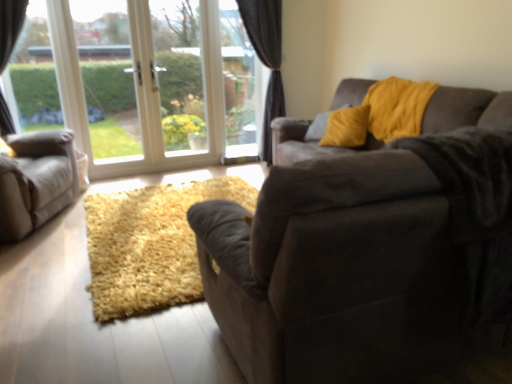
This screenshot has width=512, height=384. Find the location of `yellow fabric pillow at upper center`. yellow fabric pillow at upper center is located at coordinates (317, 127).

Where is `dark gray velvet curtain at center`? The height and width of the screenshot is (384, 512). dark gray velvet curtain at center is located at coordinates coord(266,58).

Where is `shaggy yellow rug at center`? The image size is (512, 384). shaggy yellow rug at center is located at coordinates (150, 245).

Image resolution: width=512 pixels, height=384 pixels. I want to click on yellow fabric pillow at upper center, so click(317, 127).

From a real-world perspective, is yellow fabric pillow at upper center positioned under white glass window at upper left based on gravity?

Indeed, from a real-world perspective, yellow fabric pillow at upper center is positioned beneath white glass window at upper left.

Is point (319, 133) in front of point (11, 102)?

No, it is not.

Can you confirm if yellow fabric pillow at upper center is positioned to the right of white glass window at upper left?

Correct, you'll find yellow fabric pillow at upper center to the right of white glass window at upper left.

Considering the sizes of objects yellow fabric pillow at upper center and white glass window at upper left in the image provided, who is bigger, yellow fabric pillow at upper center or white glass window at upper left?

white glass window at upper left is bigger.

Which is in front, dark gray velvet curtain at center or transparent glass door at upper left, positioned as the 1th window screen in left-to-right order?

Positioned in front is transparent glass door at upper left, positioned as the 1th window screen in left-to-right order.

The image size is (512, 384). In order to click on window screen that is the 2nd object above the dark gray velvet curtain at center (from a real-world perspective) in this screenshot , I will do `click(109, 85)`.

Is point (279, 86) more distant than point (90, 108)?

Yes, point (279, 86) is behind point (90, 108).

In terms of size, does dark gray velvet curtain at center appear bigger or smaller than transparent glass door at upper left, the 3th window screen from the right?

Considering their sizes, dark gray velvet curtain at center takes up more space than transparent glass door at upper left, the 3th window screen from the right.

From the image's perspective, which object appears higher, suede couch at center, which is the 1th studio couch in right-to-left order, or dark gray velvet curtain at center?

dark gray velvet curtain at center is shown above in the image.

The image size is (512, 384). Find the location of `curtain that appears behind the suede couch at center, the second studio couch when ordered from left to right`. curtain that appears behind the suede couch at center, the second studio couch when ordered from left to right is located at coordinates (266, 58).

Can you confirm if suede couch at center, which is the 1th studio couch in right-to-left order, is smaller than dark gray velvet curtain at center?

Incorrect, suede couch at center, which is the 1th studio couch in right-to-left order, is not smaller in size than dark gray velvet curtain at center.

Are suede couch at center, the second studio couch when ordered from left to right, and dark gray velvet curtain at center making contact?

suede couch at center, the second studio couch when ordered from left to right, and dark gray velvet curtain at center are not in contact.

Choose the correct answer: Is shaggy yellow rug at center inside dark gray velvet curtain at center or outside it?

shaggy yellow rug at center exists outside the volume of dark gray velvet curtain at center.

From a real-world perspective, is shaggy yellow rug at center located beneath dark gray velvet curtain at center?

Yes, from a real-world perspective, shaggy yellow rug at center is beneath dark gray velvet curtain at center.

Is point (136, 273) positioned in front of point (271, 141)?

Yes.

Considering the positions of point (16, 196) and point (200, 79), is point (16, 196) closer or farther from the camera than point (200, 79)?

Point (16, 196) appears to be closer to the viewer than point (200, 79).

Considering the relative sizes of matte gray armchair at left, positioned as the 1th studio couch in left-to-right order, and white glass door at center, acting as the second window screen starting from the left, in the image provided, is matte gray armchair at left, positioned as the 1th studio couch in left-to-right order, wider than white glass door at center, acting as the second window screen starting from the left,?

Yes.

From a real-world perspective, which object stands above the other?

white glass door at center, the 2th window screen from the right, is physically above.

Consider the image. Is white glass door at center, acting as the second window screen starting from the left, completely or partially inside matte gray armchair at left, arranged as the 2th studio couch when viewed from the right?

That's incorrect, white glass door at center, acting as the second window screen starting from the left, is not inside matte gray armchair at left, arranged as the 2th studio couch when viewed from the right.

Considering the points (89, 106) and (5, 199), which point is behind, point (89, 106) or point (5, 199)?

Point (89, 106)

Is transparent glass door at upper left, positioned as the 1th window screen in left-to-right order, looking in the opposite direction of matte gray armchair at left, arranged as the 2th studio couch when viewed from the right?

transparent glass door at upper left, positioned as the 1th window screen in left-to-right order, does not have its back to matte gray armchair at left, arranged as the 2th studio couch when viewed from the right.

Between transparent glass door at upper left, the 3th window screen from the right, and matte gray armchair at left, arranged as the 2th studio couch when viewed from the right, which one has more height?

transparent glass door at upper left, the 3th window screen from the right.

Who is smaller, shaggy yellow rug at center or transparent glass door at upper left, positioned as the 1th window screen in left-to-right order?

With smaller size is transparent glass door at upper left, positioned as the 1th window screen in left-to-right order.

At what (x,y) coordinates should I click in order to perform the action: click on doormat below the transparent glass door at upper left, the 3th window screen from the right (from the image's perspective). Please return your answer as a coordinate pair (x, y). The height and width of the screenshot is (384, 512). Looking at the image, I should click on (150, 245).

Does shaggy yellow rug at center have a lesser height compared to transparent glass door at upper left, the 3th window screen from the right?

Yes, shaggy yellow rug at center is shorter than transparent glass door at upper left, the 3th window screen from the right.

Does shaggy yellow rug at center turn towards transparent glass door at upper left, the 3th window screen from the right?

No, shaggy yellow rug at center does not turn towards transparent glass door at upper left, the 3th window screen from the right.

Image resolution: width=512 pixels, height=384 pixels. I want to click on window that is above the yellow fabric pillow at upper center (from the image's perspective), so click(x=144, y=83).

What are the coordinates of `curtain below the transparent glass door at upper left, positioned as the 1th window screen in left-to-right order (from a real-world perspective)` in the screenshot? It's located at (266, 58).

When comparing their distances from white glass window at upper left, does suede couch at center, which is the 1th studio couch in right-to-left order, or yellow velvet pillow at upper right seem further?

suede couch at center, which is the 1th studio couch in right-to-left order, is positioned further to the anchor white glass window at upper left.

Estimate the real-world distances between objects in this image. Which object is closer to matte gray armchair at left, arranged as the 2th studio couch when viewed from the right, transparent glass window screen at center, the first window screen when ordered from right to left, or dark gray velvet curtain at center?

transparent glass window screen at center, the first window screen when ordered from right to left, is closer to matte gray armchair at left, arranged as the 2th studio couch when viewed from the right.

Which object lies further to the anchor point white glass window at upper left, suede couch at center, the second studio couch when ordered from left to right, or dark gray velvet curtain at center?

suede couch at center, the second studio couch when ordered from left to right, lies further to white glass window at upper left than the other object.

From the image, which object appears to be nearer to matte gray armchair at left, arranged as the 2th studio couch when viewed from the right, transparent glass door at upper left, the 3th window screen from the right, or white glass door at center, acting as the second window screen starting from the left?

transparent glass door at upper left, the 3th window screen from the right, is closer to matte gray armchair at left, arranged as the 2th studio couch when viewed from the right.

Considering their positions, is matte gray armchair at left, positioned as the 1th studio couch in left-to-right order, positioned further to suede couch at center, which is the 1th studio couch in right-to-left order, than yellow fabric pillow at upper center?

yellow fabric pillow at upper center is positioned further to the anchor suede couch at center, which is the 1th studio couch in right-to-left order.

Estimate the real-world distances between objects in this image. Which object is further from dark gray velvet curtain at center, transparent glass window screen at center, the first window screen when ordered from right to left, or yellow fabric pillow at upper center?

Based on the image, yellow fabric pillow at upper center appears to be further to dark gray velvet curtain at center.

From the image, which object appears to be nearer to yellow fabric pillow at upper center, suede couch at center, which is the 1th studio couch in right-to-left order, or yellow velvet pillow at upper right?

Among the two, yellow velvet pillow at upper right is located nearer to yellow fabric pillow at upper center.

When comparing their distances from white glass door at center, acting as the second window screen starting from the left, does white glass window at upper left or yellow velvet pillow at upper right seem further?

The object further to white glass door at center, acting as the second window screen starting from the left, is yellow velvet pillow at upper right.

This screenshot has height=384, width=512. In order to click on window between matte gray armchair at left, positioned as the 1th studio couch in left-to-right order, and transparent glass window screen at center, the first window screen when ordered from right to left, from front to back in this screenshot , I will do `click(144, 83)`.

Where is `window between matte gray armchair at left, arranged as the 2th studio couch when viewed from the right, and white glass door at center, acting as the second window screen starting from the left, along the z-axis`? This screenshot has height=384, width=512. window between matte gray armchair at left, arranged as the 2th studio couch when viewed from the right, and white glass door at center, acting as the second window screen starting from the left, along the z-axis is located at coordinates (144, 83).

The width and height of the screenshot is (512, 384). What are the coordinates of `studio couch between suede couch at center, the second studio couch when ordered from left to right, and transparent glass window screen at center, the 3th window screen positioned from the left, in the front-back direction` in the screenshot? It's located at (36, 181).

Find the location of `window between shaggy yellow rug at center and white glass door at center, acting as the second window screen starting from the left, along the z-axis`. window between shaggy yellow rug at center and white glass door at center, acting as the second window screen starting from the left, along the z-axis is located at coordinates (144, 83).